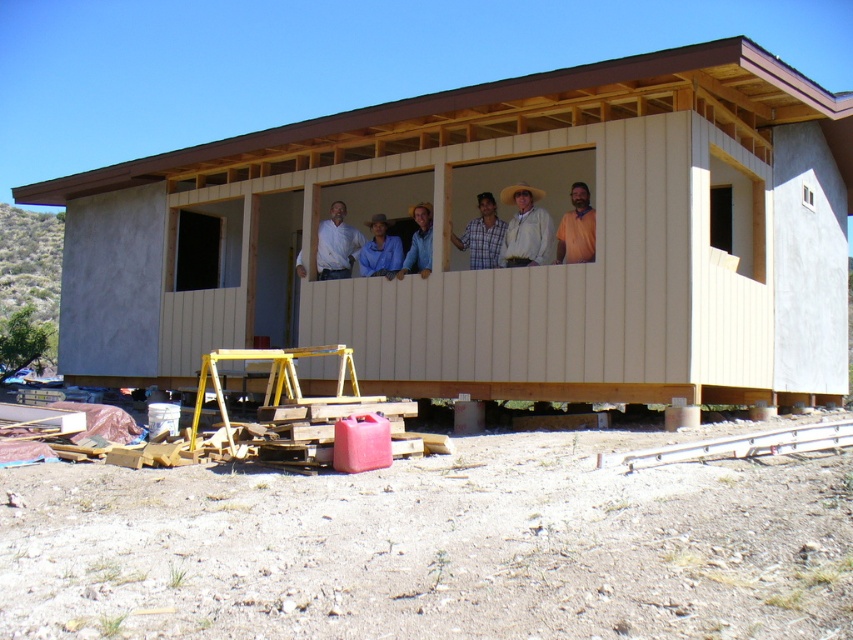
Is beige wood cabin at center positioned before white shirt at center?

That is True.

Is point (68, 180) positioned in front of point (329, 260)?

That is False.

Identify the location of beige wood cabin at center. (497, 269).

Between point (347, 268) and point (567, 257), which one is positioned behind?

The point (347, 268) is behind.

Does point (363, 241) come farther from viewer compared to point (570, 224)?

Yes.

This screenshot has width=853, height=640. What do you see at coordinates (335, 244) in the screenshot?
I see `white shirt at center` at bounding box center [335, 244].

This screenshot has height=640, width=853. I want to click on white shirt at center, so click(335, 244).

Which is in front, point (302, 269) or point (485, 205)?

Point (485, 205) is more forward.

Does white shirt at center appear under plaid shirt at center?

Yes.

This screenshot has width=853, height=640. What are the coordinates of `white shirt at center` in the screenshot? It's located at (335, 244).

What are the coordinates of `white shirt at center` in the screenshot? It's located at (335, 244).